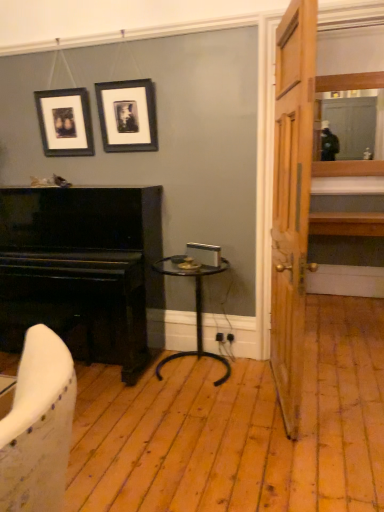
Question: Does black metal side table at center have a greater height compared to wooden door at right?

Choices:
 (A) yes
 (B) no

Answer: (B)

Question: Can you confirm if black metal side table at center is bigger than wooden door at right?

Choices:
 (A) no
 (B) yes

Answer: (A)

Question: Considering the relative positions of black metal side table at center and wooden door at right in the image provided, is black metal side table at center to the right of wooden door at right from the viewer's perspective?

Choices:
 (A) no
 (B) yes

Answer: (A)

Question: Considering the relative sizes of black metal side table at center and wooden door at right in the image provided, is black metal side table at center smaller than wooden door at right?

Choices:
 (A) no
 (B) yes

Answer: (B)

Question: Is black metal side table at center positioned in front of wooden door at right?

Choices:
 (A) yes
 (B) no

Answer: (B)

Question: Can you confirm if black metal side table at center is thinner than wooden door at right?

Choices:
 (A) no
 (B) yes

Answer: (A)

Question: Is matte black picture frame at upper left, which is the first picture frame in left-to-right order, facing towards wooden door at right?

Choices:
 (A) no
 (B) yes

Answer: (A)

Question: Does matte black picture frame at upper left, the second picture frame from the right, have a smaller size compared to wooden door at right?

Choices:
 (A) yes
 (B) no

Answer: (A)

Question: Is matte black picture frame at upper left, the second picture frame from the right, at the left side of wooden door at right?

Choices:
 (A) yes
 (B) no

Answer: (A)

Question: Is matte black picture frame at upper left, the second picture frame from the right, further to camera compared to wooden door at right?

Choices:
 (A) yes
 (B) no

Answer: (A)

Question: Is matte black picture frame at upper left, which is the first picture frame in left-to-right order, next to wooden door at right?

Choices:
 (A) no
 (B) yes

Answer: (A)

Question: Considering the relative sizes of matte black picture frame at upper left, the second picture frame from the right, and wooden door at right in the image provided, is matte black picture frame at upper left, the second picture frame from the right, shorter than wooden door at right?

Choices:
 (A) no
 (B) yes

Answer: (B)

Question: Is black matte picture frame at upper center, which is counted as the 2th picture frame, starting from the left, at the left side of black polished piano at left?

Choices:
 (A) yes
 (B) no

Answer: (B)